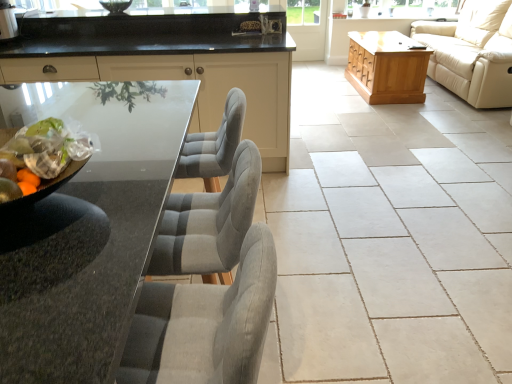
You are a GUI agent. You are given a task and a screenshot of the screen. Output one action in this format:
    pyautogui.click(x=<x>, y=<y>)
    Task: Click on the vacant space that is to the left of light brown wooden chest at right
    This screenshot has width=512, height=384.
    Given the screenshot: What is the action you would take?
    pyautogui.click(x=324, y=94)